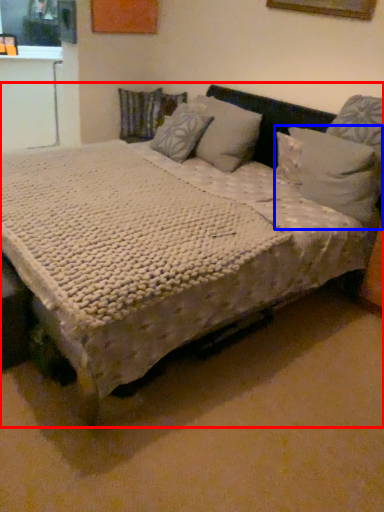
Question: Which point is further to the camera, bed (highlighted by a red box) or pillow (highlighted by a blue box)?

Choices:
 (A) bed
 (B) pillow

Answer: (B)